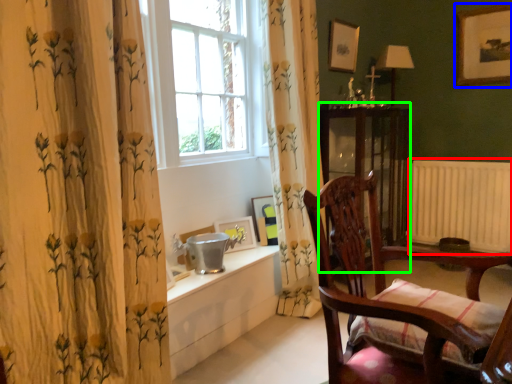
Question: Considering the real-world distances, which object is farthest from radiator (highlighted by a red box)? picture frame (highlighted by a blue box) or screen door (highlighted by a green box)?

Choices:
 (A) picture frame
 (B) screen door

Answer: (A)